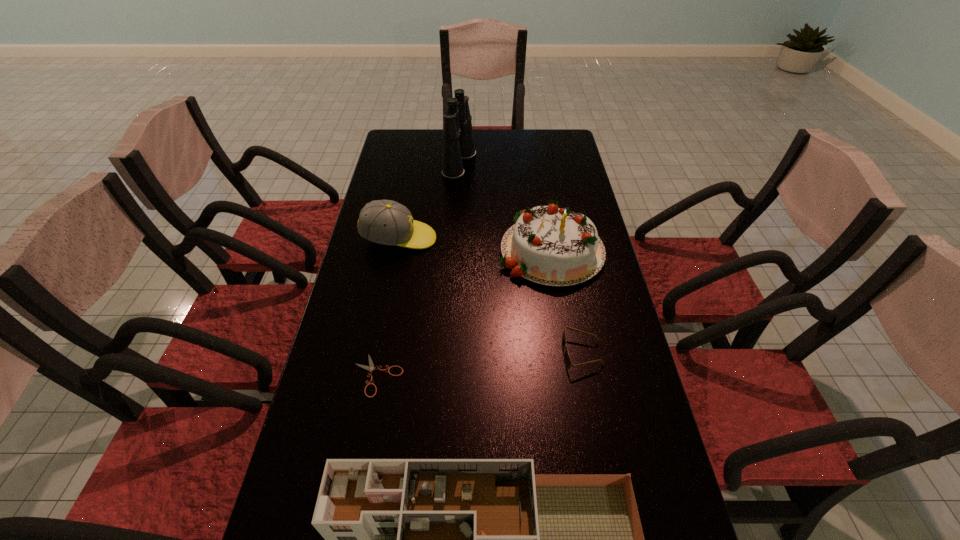
Where is `vacant space that satisfies the following two spatial constraints: 1. on the front side of the cake; 2. on the right side of the farthest object`? vacant space that satisfies the following two spatial constraints: 1. on the front side of the cake; 2. on the right side of the farthest object is located at coordinates (454, 249).

The height and width of the screenshot is (540, 960). Find the location of `free location that satisfies the following two spatial constraints: 1. on the back side of the second tallest object; 2. on the front-facing side of the baseball cap`. free location that satisfies the following two spatial constraints: 1. on the back side of the second tallest object; 2. on the front-facing side of the baseball cap is located at coordinates (549, 239).